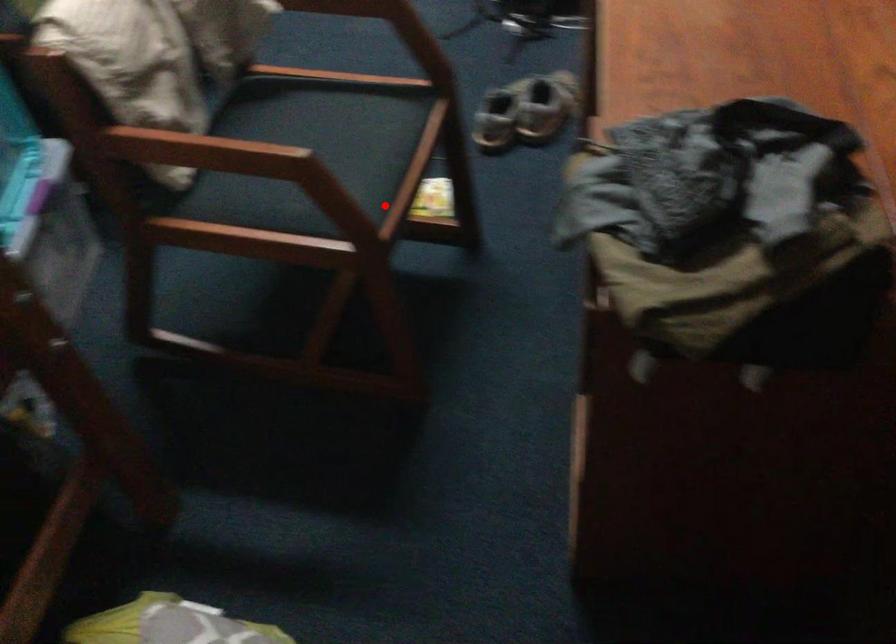
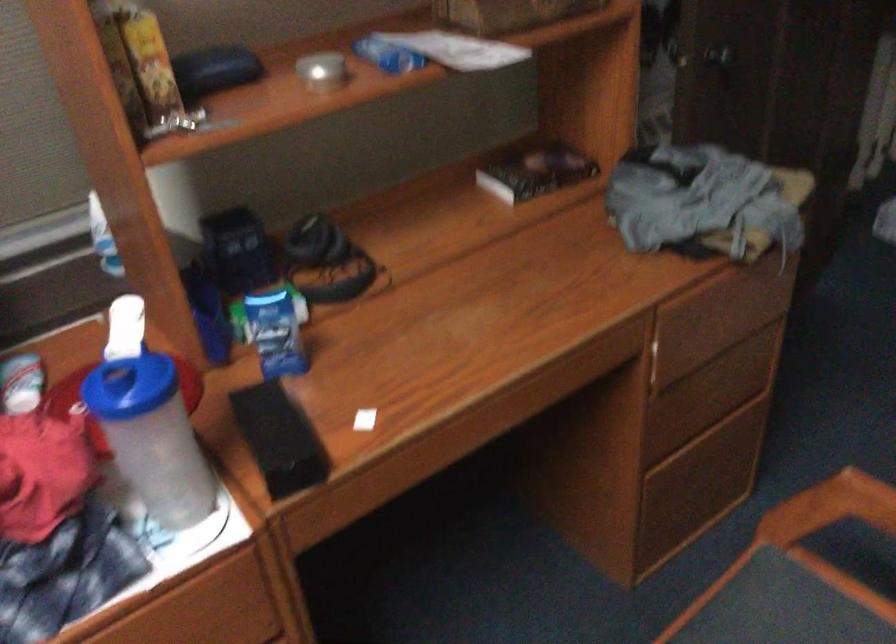
Where in the second image is the point corresponding to the highlighted location from the first image?

(780, 614)